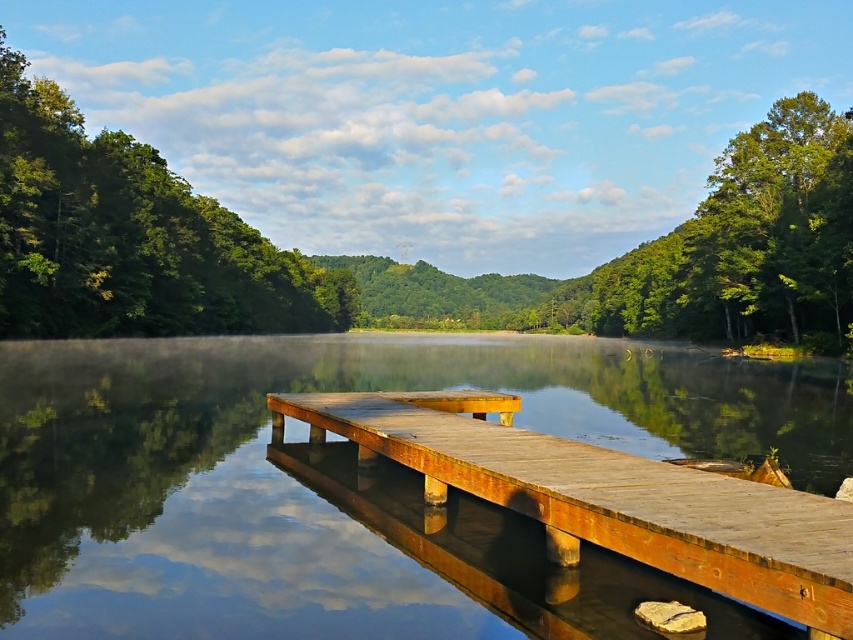
What do you see at coordinates (138, 240) in the screenshot?
I see `green leafy tree at center` at bounding box center [138, 240].

Who is shorter, green leafy tree at center or green leafy tree at left?

green leafy tree at left is shorter.

Locate an element on the screen. This screenshot has height=640, width=853. green leafy tree at center is located at coordinates coord(138,240).

Find the location of a particular element. The width and height of the screenshot is (853, 640). green leafy tree at center is located at coordinates (138, 240).

Can you confirm if green leafy tree at left is shorter than rustic wood dock at center?

No.

Does green leafy tree at left have a smaller size compared to rustic wood dock at center?

Incorrect, green leafy tree at left is not smaller in size than rustic wood dock at center.

Identify the location of green leafy tree at left. (131, 237).

Who is more forward, (76, 220) or (822, 625)?

Point (822, 625)

Identify the location of green leafy tree at center. (138, 240).